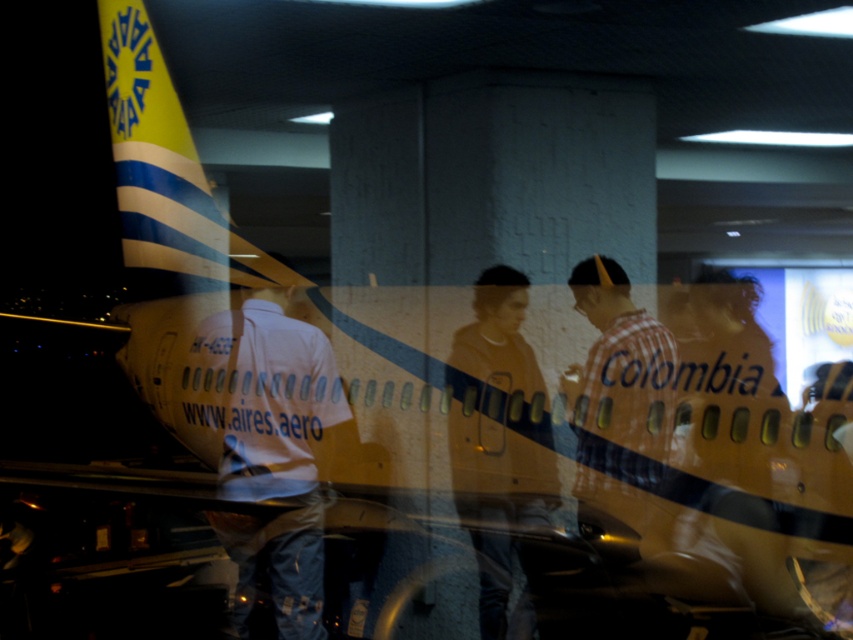
From the picture: You are observing the reflection in the window and see a white shirt at center and a checkered fabric shirt at right. Which shirt is positioned lower in the reflection?

The white shirt at center is located below the checkered fabric shirt at right in the reflection.

You are observing the reflection in the window and see the dark gray hoodie at center and checkered fabric shirt at right. Which one is positioned lower in the reflection?

The dark gray hoodie at center is located below the checkered fabric shirt at right in the reflection.